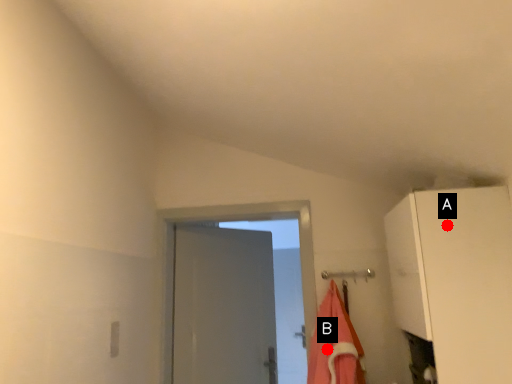
Question: Two points are circled on the image, labeled by A and B beside each circle. Among these points, which one is nearest to the camera?

Choices:
 (A) A is closer
 (B) B is closer

Answer: (A)